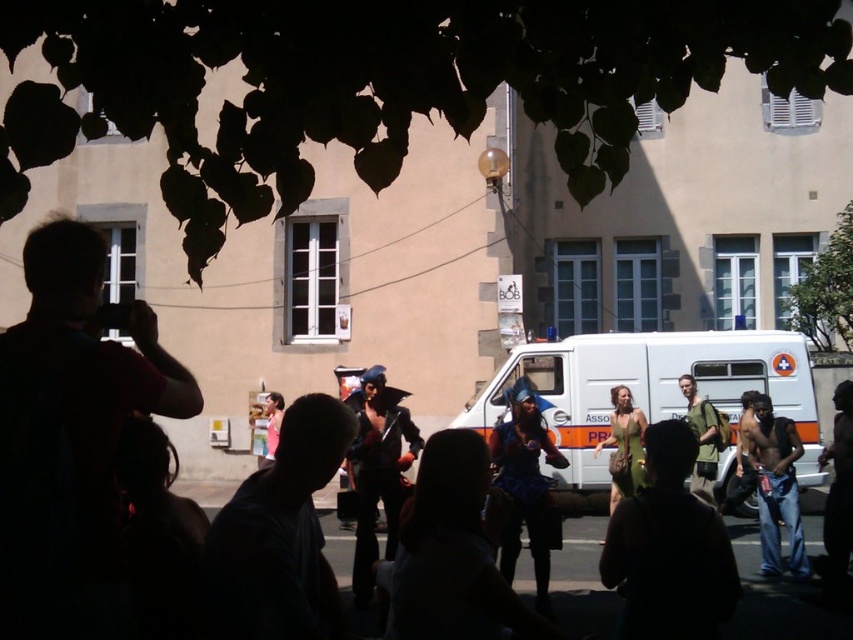
Who is more distant from viewer, (515, 400) or (764, 454)?

The point (515, 400) is more distant.

Is shiny blue costume at center thinner than denim jeans at lower right?

Indeed, shiny blue costume at center has a lesser width compared to denim jeans at lower right.

At what (x,y) coordinates should I click in order to perform the action: click on shiny blue costume at center. Please return your answer as a coordinate pair (x, y). Image resolution: width=853 pixels, height=640 pixels. Looking at the image, I should click on (526, 486).

Does white matte van at center appear on the right side of pink fabric dress at center?

Correct, you'll find white matte van at center to the right of pink fabric dress at center.

Between white matte van at center and pink fabric dress at center, which one is positioned lower?

Positioned lower is pink fabric dress at center.

Describe the element at coordinates (648, 390) in the screenshot. This screenshot has height=640, width=853. I see `white matte van at center` at that location.

Find the location of a particular element. The image size is (853, 640). white matte van at center is located at coordinates (648, 390).

Can you confirm if denim jeans at lower right is wider than pink fabric dress at center?

Yes, denim jeans at lower right is wider than pink fabric dress at center.

Which is more to the left, denim jeans at lower right or pink fabric dress at center?

From the viewer's perspective, pink fabric dress at center appears more on the left side.

At what (x,y) coordinates should I click in order to perform the action: click on denim jeans at lower right. Please return your answer as a coordinate pair (x, y). Looking at the image, I should click on (776, 486).